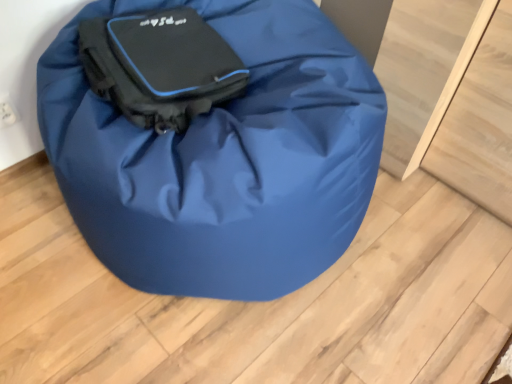
Question: Should I look upward or downward to see matte black bag at center, acting as the 2th luggage and bags starting from the back?

Choices:
 (A) up
 (B) down

Answer: (A)

Question: From the image's perspective, would you say matte black bag at center, acting as the first luggage and bags starting from the back, is positioned over matte black bag at center, acting as the 2th luggage and bags starting from the back?

Choices:
 (A) yes
 (B) no

Answer: (A)

Question: Does matte black bag at center, acting as the 2th luggage and bags starting from the front, have a lesser height compared to matte black bag at center, acting as the 2th luggage and bags starting from the back?

Choices:
 (A) no
 (B) yes

Answer: (B)

Question: From a real-world perspective, is matte black bag at center, acting as the 2th luggage and bags starting from the front, positioned under matte black bag at center, acting as the 2th luggage and bags starting from the back, based on gravity?

Choices:
 (A) no
 (B) yes

Answer: (A)

Question: Is matte black bag at center, acting as the first luggage and bags starting from the back, to the right of matte black bag at center, which is the first luggage and bags from front to back, from the viewer's perspective?

Choices:
 (A) no
 (B) yes

Answer: (A)

Question: From the image's perspective, is matte black bag at center, acting as the first luggage and bags starting from the back, located beneath matte black bag at center, which is the first luggage and bags from front to back?

Choices:
 (A) no
 (B) yes

Answer: (A)

Question: Does matte black bag at center, acting as the 2th luggage and bags starting from the front, turn towards matte black bag at center, acting as the 2th luggage and bags starting from the back?

Choices:
 (A) yes
 (B) no

Answer: (A)

Question: Can you confirm if matte black bag at center, acting as the 2th luggage and bags starting from the back, is thinner than matte black bag at center, acting as the first luggage and bags starting from the back?

Choices:
 (A) yes
 (B) no

Answer: (B)

Question: Considering the relative positions of matte black bag at center, acting as the 2th luggage and bags starting from the back, and matte black bag at center, acting as the 2th luggage and bags starting from the front, in the image provided, is matte black bag at center, acting as the 2th luggage and bags starting from the back, to the left of matte black bag at center, acting as the 2th luggage and bags starting from the front, from the viewer's perspective?

Choices:
 (A) no
 (B) yes

Answer: (A)

Question: Can you confirm if matte black bag at center, which is the first luggage and bags from front to back, is positioned to the right of matte black bag at center, acting as the first luggage and bags starting from the back?

Choices:
 (A) no
 (B) yes

Answer: (B)

Question: Is matte black bag at center, which is the first luggage and bags from front to back, not within matte black bag at center, acting as the 2th luggage and bags starting from the front?

Choices:
 (A) no
 (B) yes

Answer: (B)

Question: From a real-world perspective, does matte black bag at center, which is the first luggage and bags from front to back, stand above matte black bag at center, acting as the first luggage and bags starting from the back?

Choices:
 (A) no
 (B) yes

Answer: (A)

Question: Is matte black bag at center, acting as the 2th luggage and bags starting from the back, further to the viewer compared to matte black bag at center, acting as the 2th luggage and bags starting from the front?

Choices:
 (A) yes
 (B) no

Answer: (B)

Question: From their relative heights in the image, would you say matte black bag at center, which is the first luggage and bags from front to back, is taller or shorter than matte black bag at center, acting as the first luggage and bags starting from the back?

Choices:
 (A) short
 (B) tall

Answer: (B)